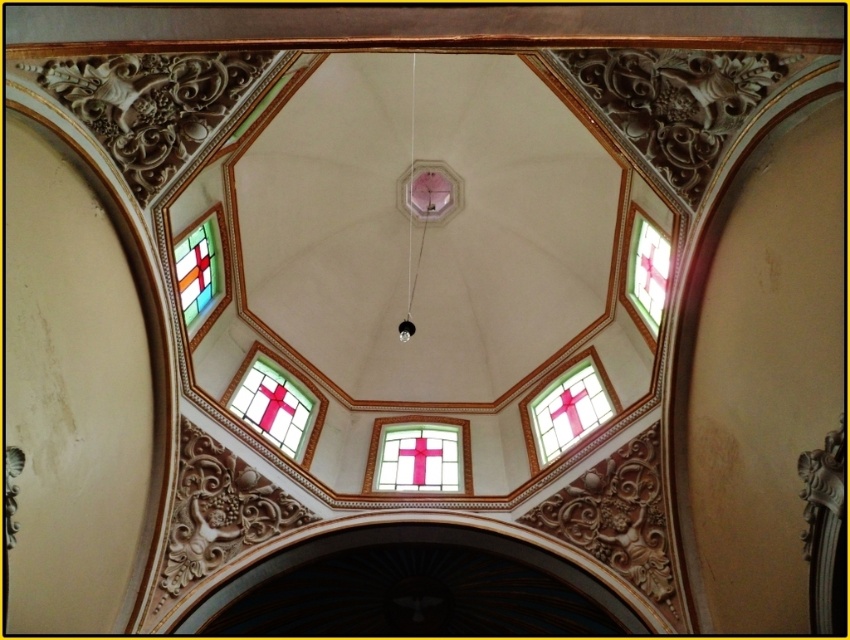
Which of these two, pink stained glass cross at center or stained glass window at upper left, stands shorter?

Standing shorter between the two is pink stained glass cross at center.

What do you see at coordinates (418, 458) in the screenshot? I see `pink stained glass cross at center` at bounding box center [418, 458].

This screenshot has height=640, width=850. I want to click on pink stained glass cross at center, so click(418, 458).

Can you confirm if translucent glass cross at upper right is positioned to the left of stained glass window at upper left?

No, translucent glass cross at upper right is not to the left of stained glass window at upper left.

From the picture: Measure the distance between translucent glass cross at upper right and stained glass window at upper left.

173.23 feet

Does point (666, 237) lie in front of point (214, 218)?

Yes, point (666, 237) is closer to viewer.

Image resolution: width=850 pixels, height=640 pixels. Identify the location of translucent glass cross at upper right. (646, 269).

Can you confirm if pink stained glass cross at center is shorter than clear glass cross at lower left?

Yes, pink stained glass cross at center is shorter than clear glass cross at lower left.

Is point (459, 426) closer to camera compared to point (282, 385)?

No, it is behind (282, 385).

The height and width of the screenshot is (640, 850). What are the coordinates of `pink stained glass cross at center` in the screenshot? It's located at (418, 458).